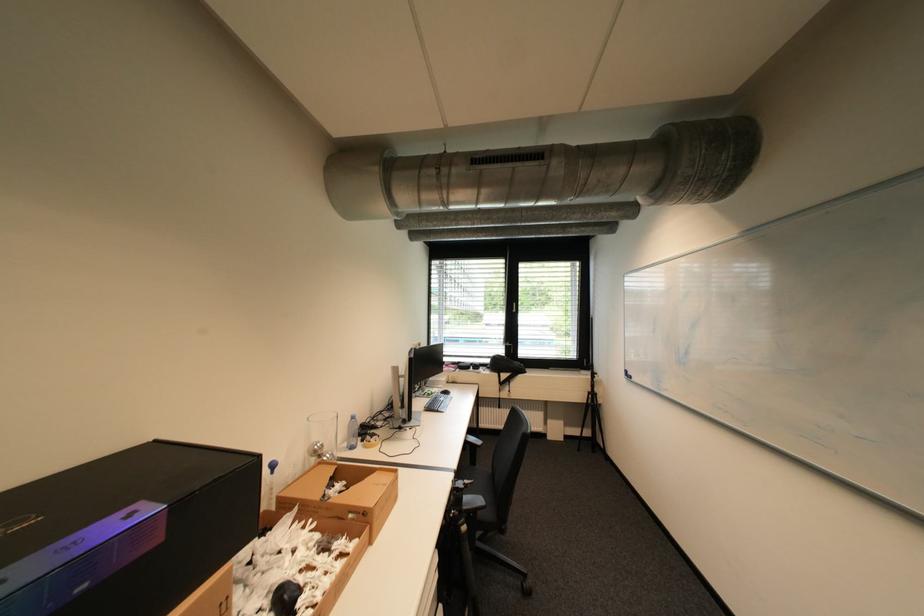
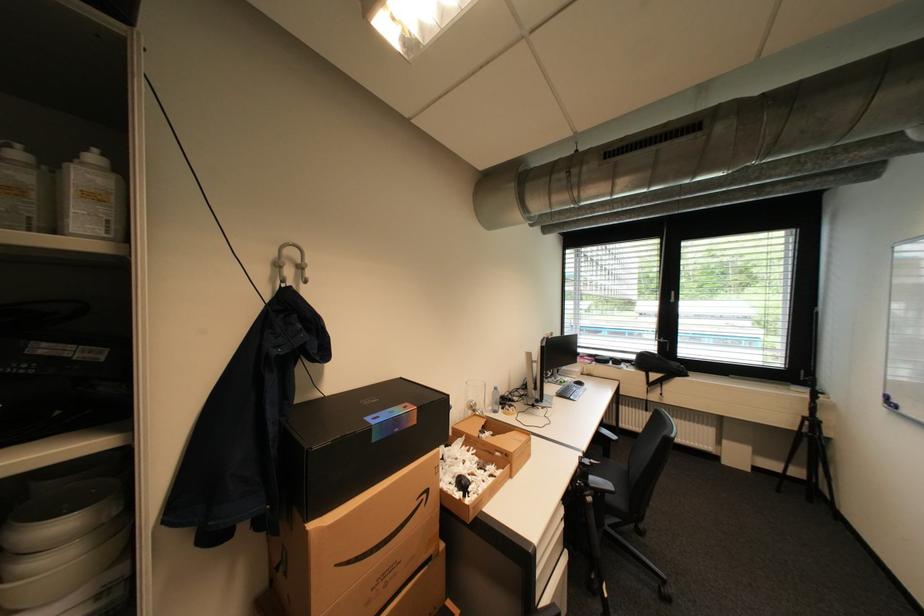
In the second image, find the point that corresponds to [516,342] in the first image.

(670, 339)